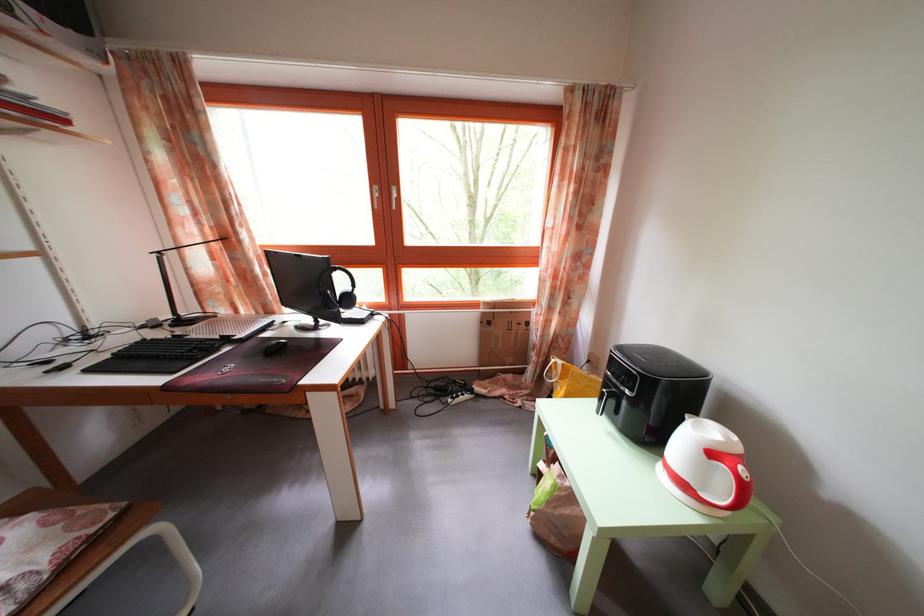
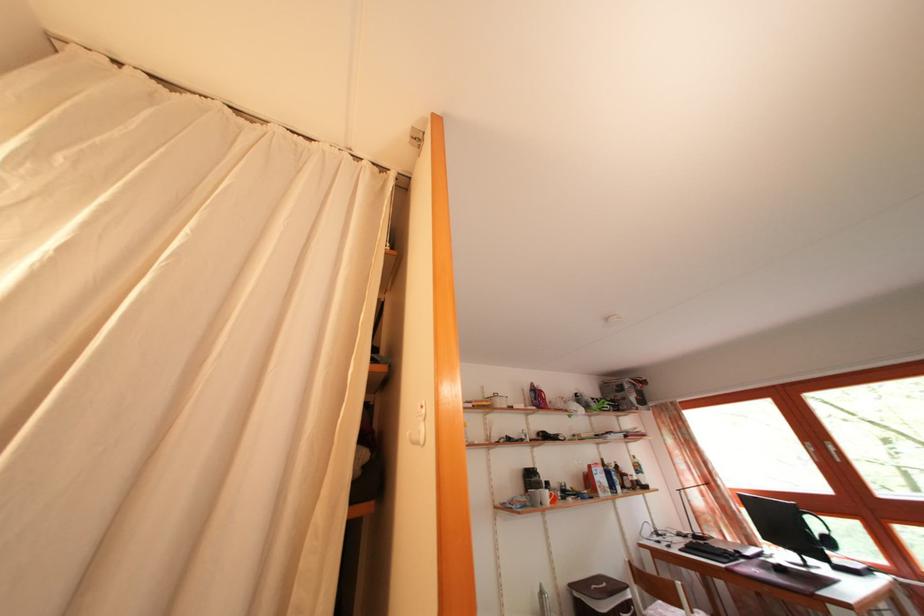
The point at (357, 307) is marked in the first image. Where is the corresponding point in the second image?

(837, 549)